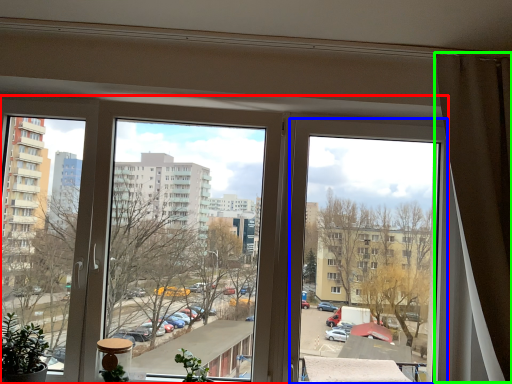
Question: Which object is positioned closest to window (highlighted by a red box)? Select from window (highlighted by a blue box) and curtain (highlighted by a green box).

Choices:
 (A) window
 (B) curtain

Answer: (A)